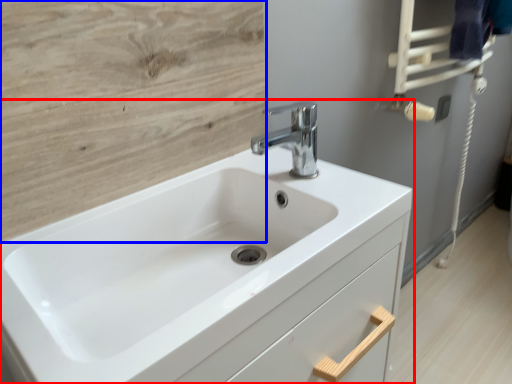
Question: Which point is further to the camera, sink (highlighted by a red box) or plywood (highlighted by a blue box)?

Choices:
 (A) sink
 (B) plywood

Answer: (B)